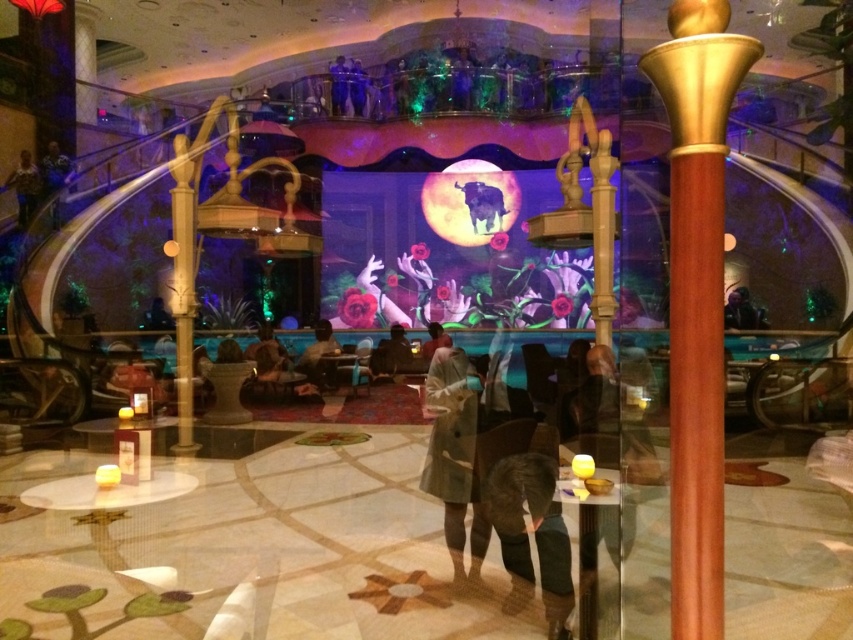
You are organizing a fashion show and need to display two jackets in the scene. The camouflage jacket at upper left and the light brown leather jacket at center. Which jacket has a larger width?

The light brown leather jacket at center has a larger width than the camouflage jacket at upper left.

You are standing at the entrance of the grand building and see the light brown wool coat at center. If you want to reach the coat as quickly as possible, in which direction should you walk from your current position?

Since the light brown wool coat at center is located at point (454, 454) in the 2D space, you should walk towards the center of the image to reach it quickly.